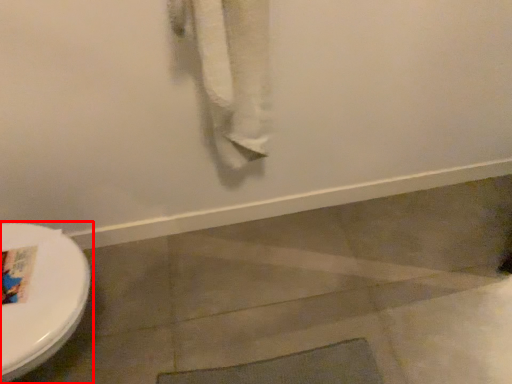
Question: Where is toilet (annotated by the red box) located in relation to bath towel in the image?

Choices:
 (A) left
 (B) right

Answer: (A)